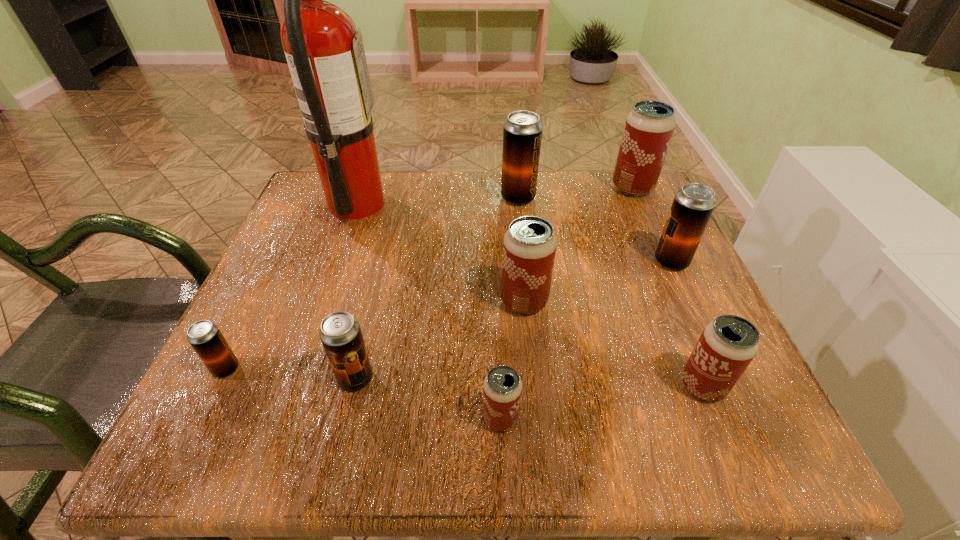
Identify the location of vacant region located on the left of the second black beer can from left to right. (293, 379).

Where is `vacant space located 0.100m on the back of the third biggest red beer can`? vacant space located 0.100m on the back of the third biggest red beer can is located at coordinates (675, 319).

This screenshot has width=960, height=540. Find the location of `free spot located 0.230m on the right of the leftmost object`. free spot located 0.230m on the right of the leftmost object is located at coordinates (384, 369).

At what (x,y) coordinates should I click in order to perform the action: click on vacant space located 0.380m on the back of the smallest red beer can. Please return your answer as a coordinate pair (x, y). The height and width of the screenshot is (540, 960). Looking at the image, I should click on click(x=494, y=240).

Locate an element on the screen. This screenshot has height=540, width=960. fire extinguisher positioned at the far edge is located at coordinates (326, 58).

You are a GUI agent. You are given a task and a screenshot of the screen. Output one action in this format:
    pyautogui.click(x=<x>, y=<y>)
    Task: Click on the fire extinguisher at the left edge
    
    Given the screenshot: What is the action you would take?
    pyautogui.click(x=326, y=58)

Where is `beer can that is at the left edge`? The width and height of the screenshot is (960, 540). beer can that is at the left edge is located at coordinates (206, 339).

I want to click on object that is positioned at the far left corner, so point(326,58).

Identify the location of object that is at the far right corner. The image size is (960, 540). (649, 127).

Identify the location of object that is positioned at the near right corner. (728, 344).